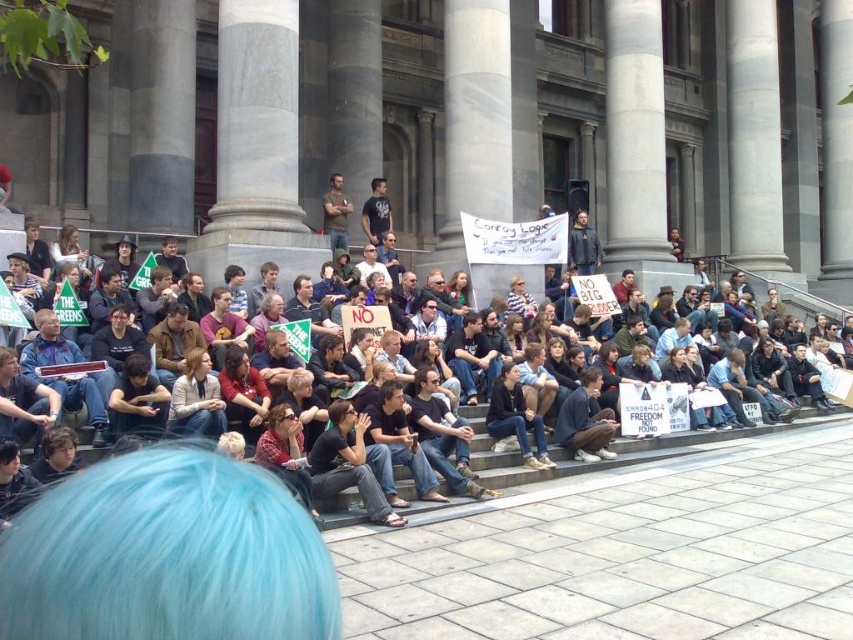
Is point (639, 444) closer to viewer compared to point (339, 184)?

Yes.

Who is shorter, matte black sign at center or dark brown leather jacket at center?

Standing shorter between the two is matte black sign at center.

Does point (556, 445) come farther from viewer compared to point (339, 240)?

No.

Image resolution: width=853 pixels, height=640 pixels. Identify the location of matte black sign at center. (590, 464).

In the scene shown: Is dark brown leather jacket at center smaller than black t-shirt at center?

No.

Is dark brown leather jacket at center closer to camera compared to black t-shirt at center?

Yes, dark brown leather jacket at center is in front of black t-shirt at center.

Does point (331, 182) come closer to viewer compared to point (367, 237)?

Yes, it is.

I want to click on dark brown leather jacket at center, so click(x=335, y=212).

Measure the distance between matte black sign at center and black t-shirt at center.

A distance of 28.57 meters exists between matte black sign at center and black t-shirt at center.

This screenshot has width=853, height=640. I want to click on matte black sign at center, so click(590, 464).